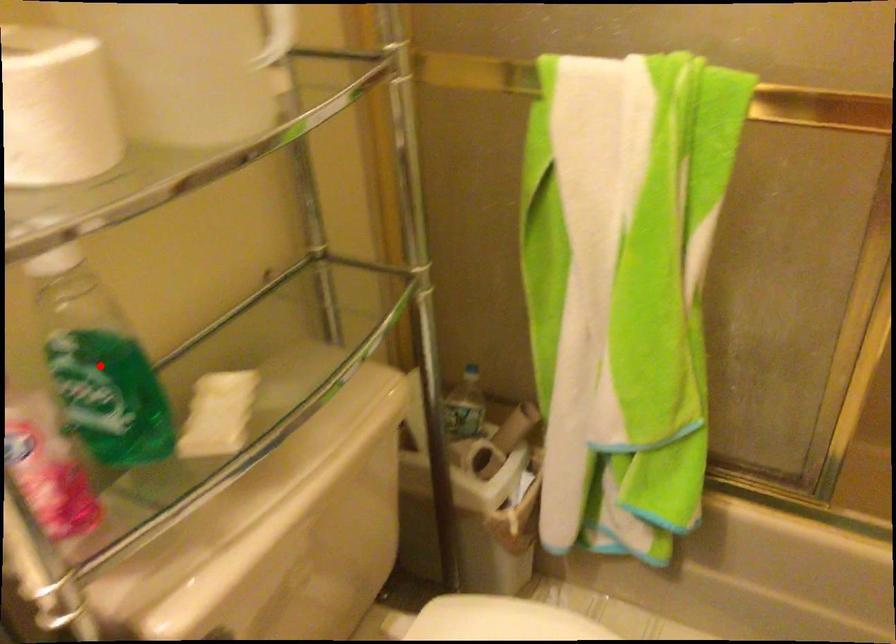
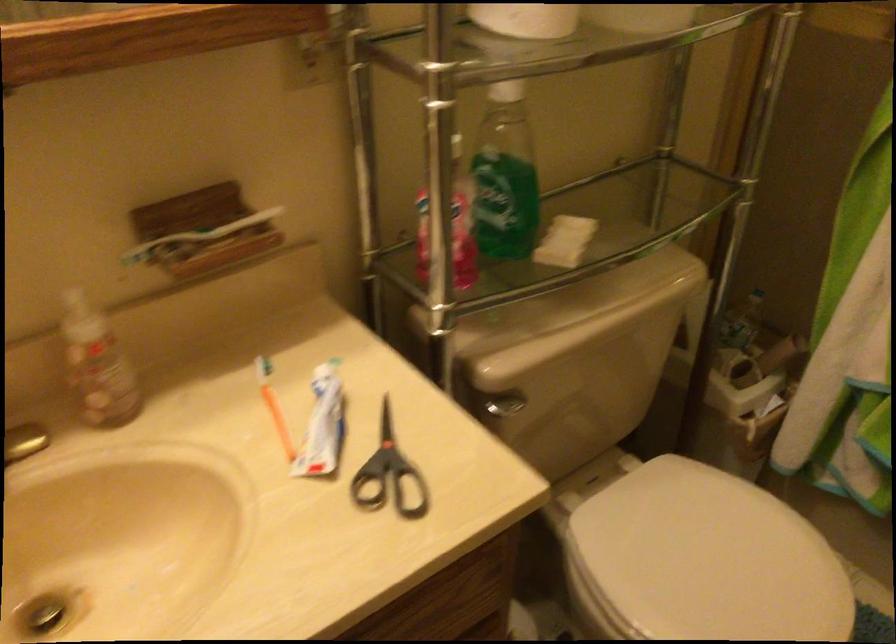
Question: I am providing you with two images of the same scene from different viewpoints. A red point is shown in image1. For the corresponding object point in image2, is it positioned nearer or farther from the camera?

Choices:
 (A) Nearer
 (B) Farther

Answer: (B)